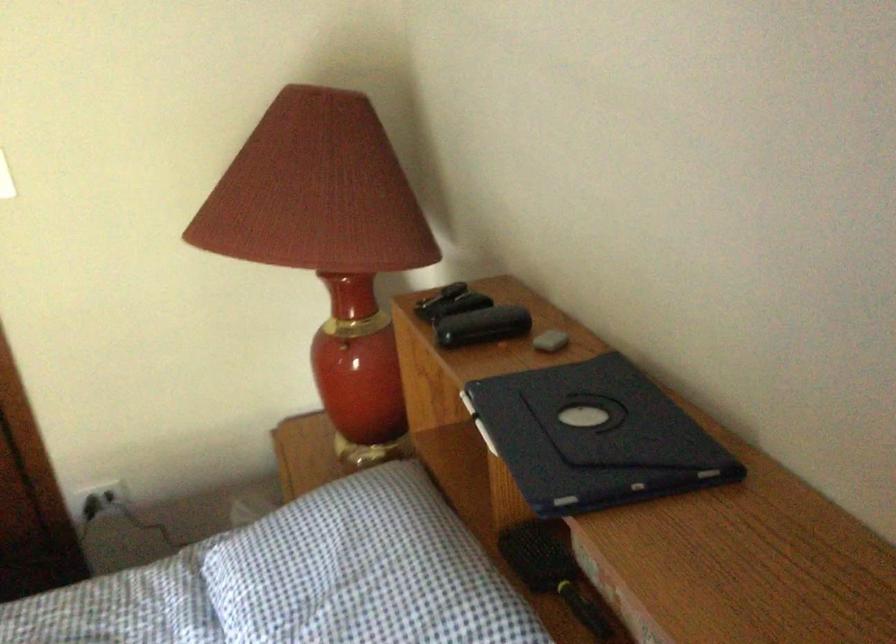
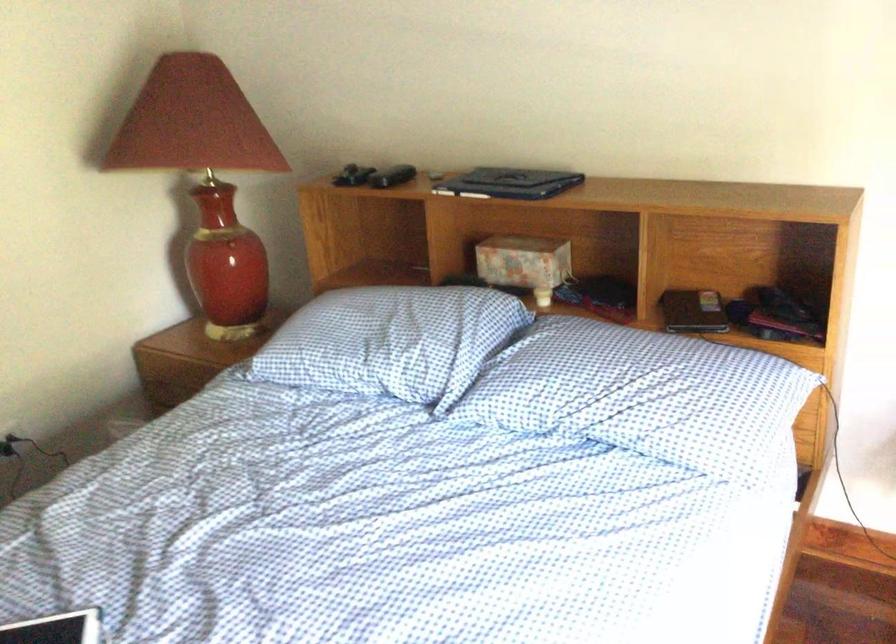
In the second image, find the point that corresponds to the point at 562,438 in the first image.

(510, 183)